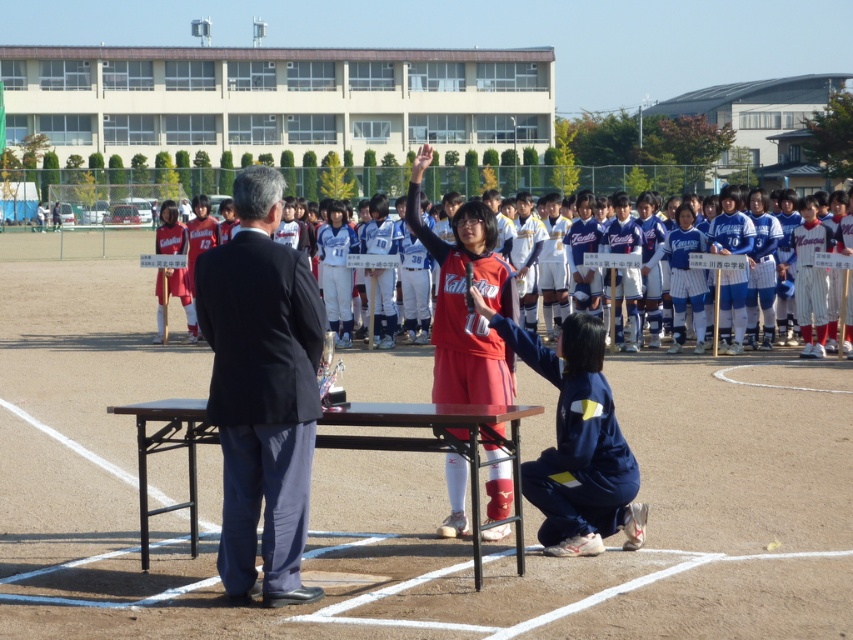
Is the position of navy blue fabric uniform at lower center less distant than that of matte red jersey at center?

No, navy blue fabric uniform at lower center is behind matte red jersey at center.

Is point (573, 349) positioned after point (439, 376)?

No, it is in front of (439, 376).

What are the coordinates of `navy blue fabric uniform at lower center` in the screenshot? It's located at (576, 442).

This screenshot has height=640, width=853. In order to click on black suit at center in this screenshot , I will do tap(260, 390).

Who is more distant from viewer, (250, 484) or (486, 490)?

The point (486, 490) is more distant.

The image size is (853, 640). I want to click on black suit at center, so click(260, 390).

Between navy blue fabric uniform at lower center and wooden table at center, which one has less height?

wooden table at center is shorter.

You are a GUI agent. You are given a task and a screenshot of the screen. Output one action in this format:
    pyautogui.click(x=<x>, y=<y>)
    Task: Click on the navy blue fabric uniform at lower center
    The height and width of the screenshot is (640, 853).
    Given the screenshot: What is the action you would take?
    pyautogui.click(x=576, y=442)

Where is `navy blue fabric uniform at lower center`? This screenshot has width=853, height=640. navy blue fabric uniform at lower center is located at coordinates (576, 442).